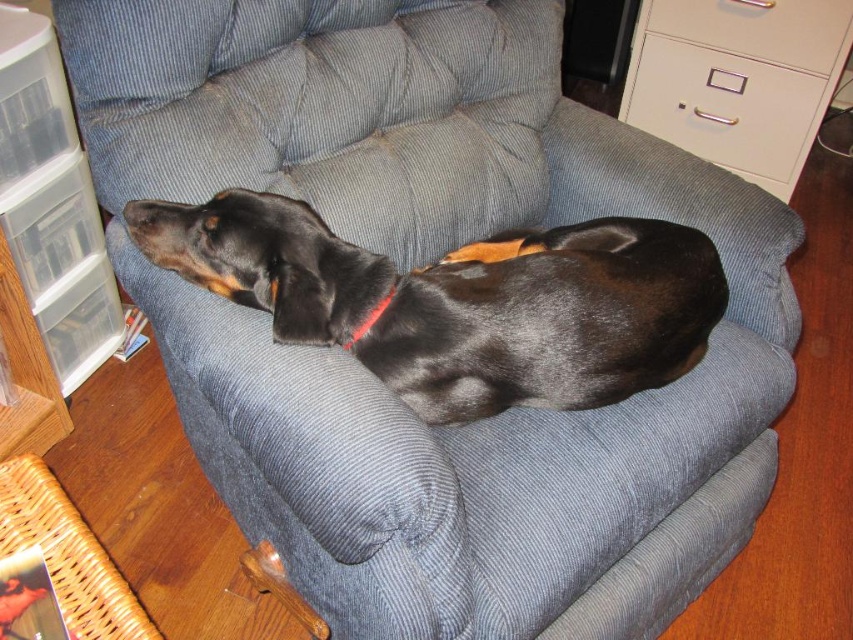
Question: Which object is closer to the camera taking this photo?

Choices:
 (A) black smooth dog at center
 (B) red fabric neckband at center

Answer: (A)

Question: Which point is closer to the camera?

Choices:
 (A) white plastic drawer at upper right
 (B) black smooth dog at center

Answer: (B)

Question: Is metallic gray file cabinet at upper right bigger than red fabric neckband at center?

Choices:
 (A) yes
 (B) no

Answer: (A)

Question: Is black smooth dog at center behind metallic gray file cabinet at upper right?

Choices:
 (A) yes
 (B) no

Answer: (B)

Question: From the image, what is the correct spatial relationship of white plastic drawer at upper right in relation to red fabric neckband at center?

Choices:
 (A) below
 (B) above

Answer: (B)

Question: Which is farther from the metallic gray file cabinet at upper right?

Choices:
 (A) black smooth dog at center
 (B) red fabric neckband at center

Answer: (B)